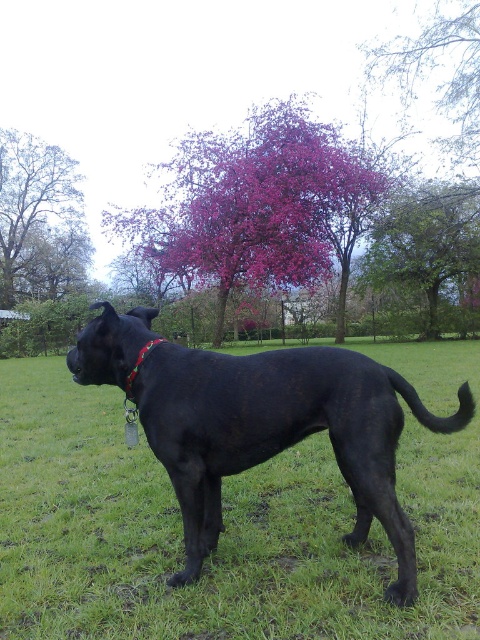
Question: Is green leafy tree at upper center thinner than red fabric neckband at center?

Choices:
 (A) no
 (B) yes

Answer: (A)

Question: Is black glossy dog at center positioned at the back of purple leafy tree at upper center?

Choices:
 (A) yes
 (B) no

Answer: (B)

Question: Which point is closer to the camera?

Choices:
 (A) pink blossoming tree at upper center
 (B) smooth bark tree at upper left
 (C) green leafy tree at upper center
 (D) red fabric neckband at center

Answer: (D)

Question: Which is farther from the smooth bark tree at upper left?

Choices:
 (A) pink blossoming tree at upper center
 (B) green leafy tree at upper center
 (C) purple leafy tree at upper center
 (D) black glossy dog at center

Answer: (D)

Question: Among these objects, which one is farthest from the camera?

Choices:
 (A) green leafy tree at upper center
 (B) black glossy dog at center
 (C) pink blossoming tree at upper center
 (D) smooth bark tree at upper left

Answer: (D)

Question: Can you confirm if black glossy dog at center is thinner than green leafy tree at upper center?

Choices:
 (A) no
 (B) yes

Answer: (A)